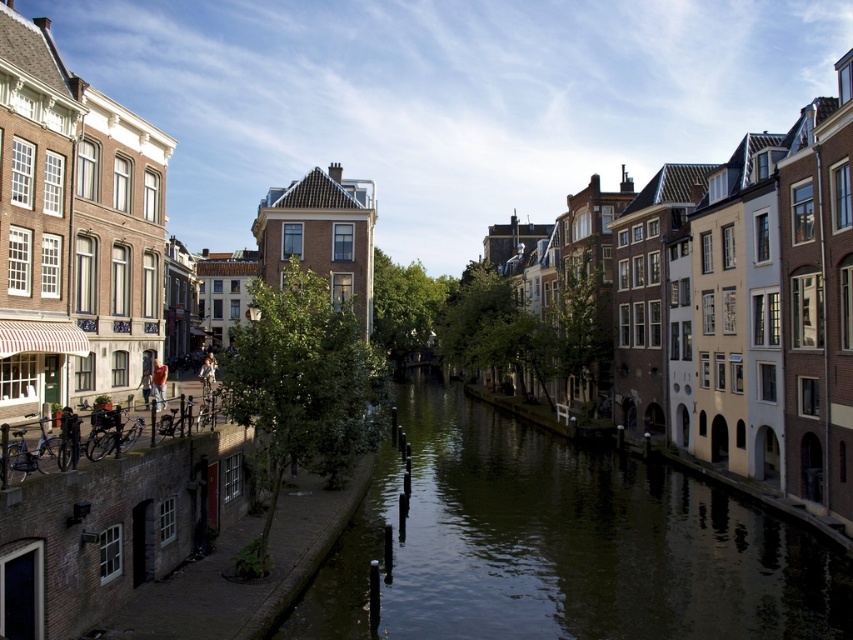
Question: Which point is farther from the camera taking this photo?

Choices:
 (A) (785, 637)
 (B) (163, 390)

Answer: (B)

Question: Which of the following is the farthest from the observer?

Choices:
 (A) light brown leather jacket at left
 (B) greenish water at center

Answer: (A)

Question: Does greenish water at center appear over light brown leather jacket at left?

Choices:
 (A) yes
 (B) no

Answer: (B)

Question: Can you confirm if greenish water at center is positioned above light brown leather jacket at left?

Choices:
 (A) no
 (B) yes

Answer: (A)

Question: Does greenish water at center have a lesser width compared to light brown leather jacket at left?

Choices:
 (A) no
 (B) yes

Answer: (A)

Question: Among these points, which one is nearest to the camera?

Choices:
 (A) (158, 371)
 (B) (358, 579)

Answer: (B)